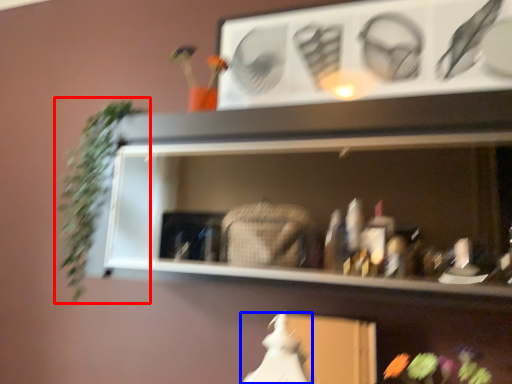
Question: Which point is closer to the camera, plant (highlighted by a red box) or fancy dress (highlighted by a blue box)?

Choices:
 (A) plant
 (B) fancy dress

Answer: (B)